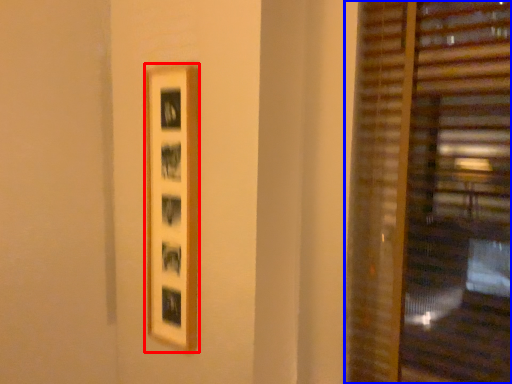
Question: Which object appears farthest to the camera in this image, picture frame (highlighted by a red box) or window blind (highlighted by a blue box)?

Choices:
 (A) picture frame
 (B) window blind

Answer: (A)